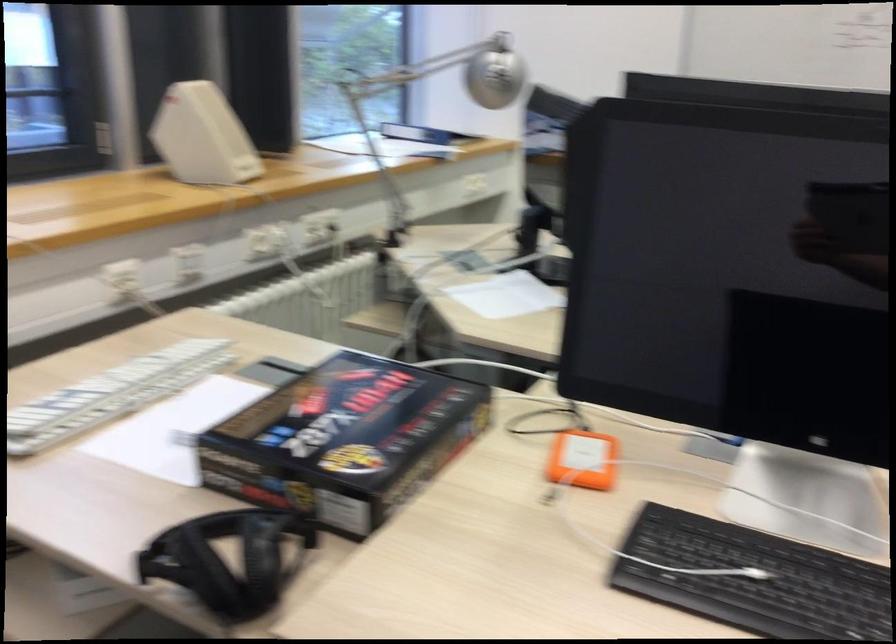
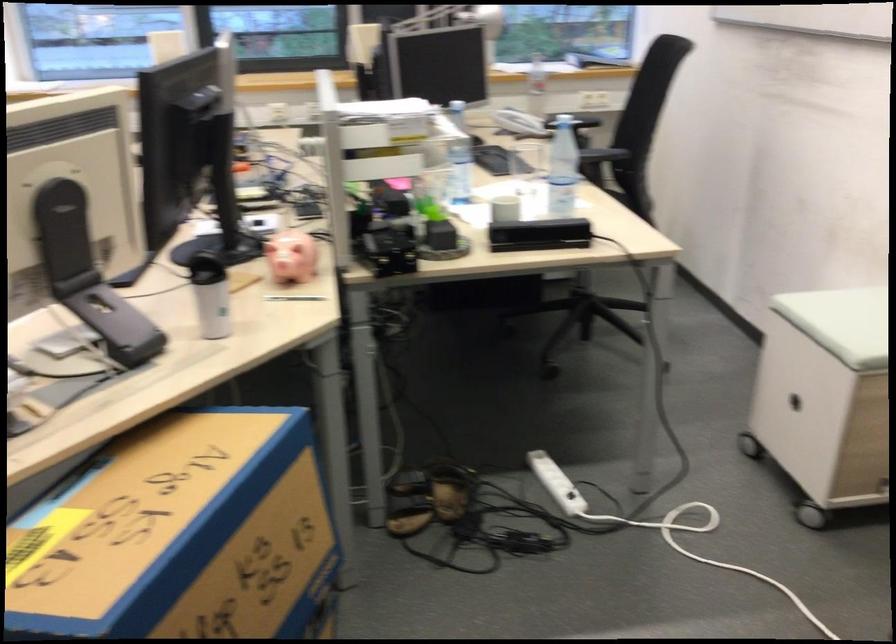
Question: I am providing you with two images of the same scene from different viewpoints. Which of the following objects are not visible in image2?

Choices:
 (A) white hardcover book
 (B) pink piggy bank
 (C) black chair armrest
 (D) white keyboard

Answer: (D)